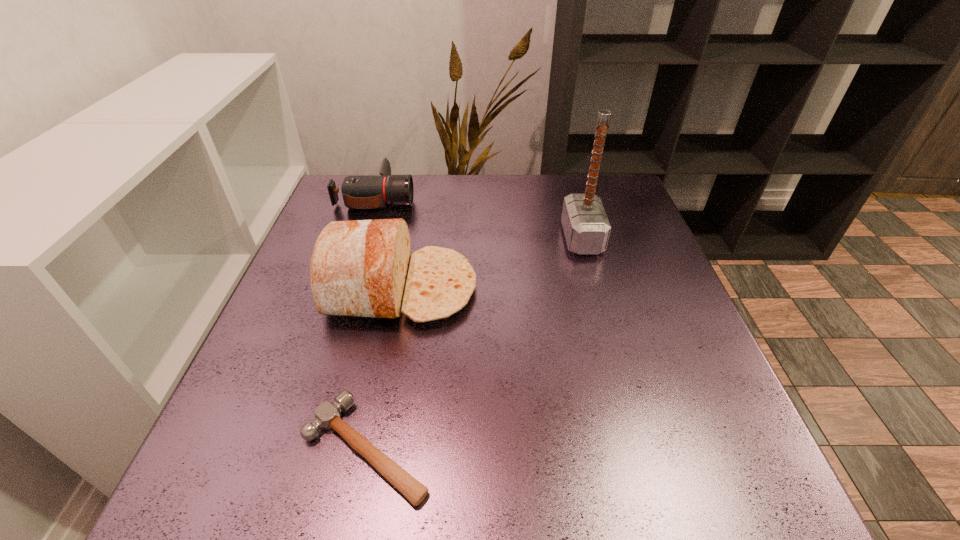
Find the location of `free space between the bread and the right hammer`. free space between the bread and the right hammer is located at coordinates (492, 264).

Find the location of a particular element. vacant area that lies between the bread and the farther hammer is located at coordinates (492, 264).

Where is `free spot between the nearest object and the farthest object`? free spot between the nearest object and the farthest object is located at coordinates (371, 323).

Locate an element on the screen. unoccupied position between the tallest object and the second shortest object is located at coordinates (479, 218).

Find the location of a particular element. This screenshot has width=960, height=540. the third closest object to the second tallest object is located at coordinates (586, 227).

Where is `object that is the second closest to the tallest object`? The width and height of the screenshot is (960, 540). object that is the second closest to the tallest object is located at coordinates (359, 192).

Image resolution: width=960 pixels, height=540 pixels. I want to click on free location that satisfies the following two spatial constraints: 1. on the lens of the left hammer; 2. on the left side of the camcorder, so click(x=294, y=448).